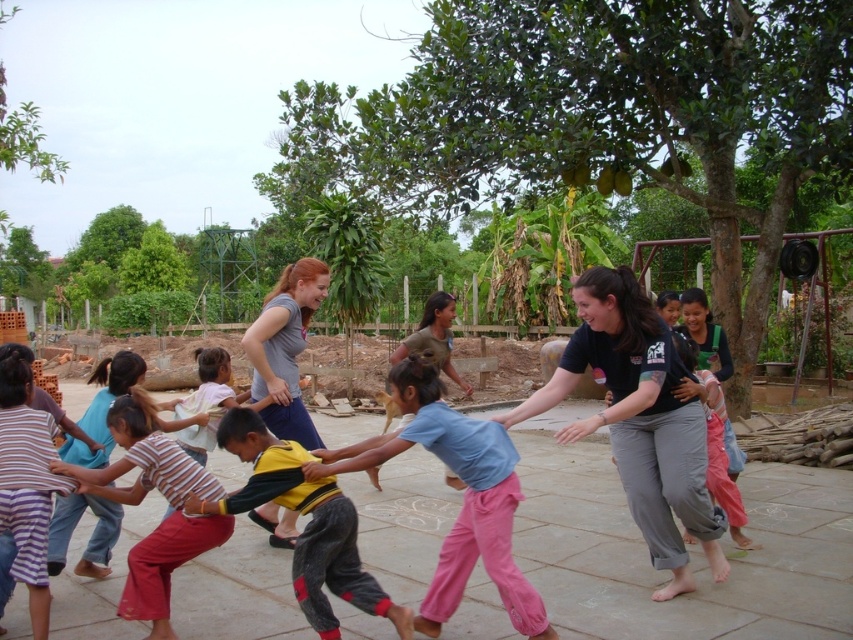
Can you confirm if striped fabric shirt at center is positioned to the left of striped cotton shirt at lower left?

Incorrect, striped fabric shirt at center is not on the left side of striped cotton shirt at lower left.

Looking at this image, can you confirm if striped fabric shirt at center is wider than striped cotton shirt at lower left?

Indeed, striped fabric shirt at center has a greater width compared to striped cotton shirt at lower left.

Find the location of a particular element. striped fabric shirt at center is located at coordinates (141, 499).

In order to click on striped fabric shirt at center in this screenshot , I will do point(141,499).

Between striped fabric shirt at center and smooth beige hand at center, which one appears on the left side from the viewer's perspective?

From the viewer's perspective, smooth beige hand at center appears more on the left side.

Who is more forward, (84, 477) or (206, 422)?

Positioned in front is point (84, 477).

You are a GUI agent. You are given a task and a screenshot of the screen. Output one action in this format:
    pyautogui.click(x=<x>, y=<y>)
    Task: Click on the striped fabric shirt at center
    The width and height of the screenshot is (853, 640).
    Given the screenshot: What is the action you would take?
    pyautogui.click(x=141, y=499)

Which is in front, point (479, 516) or point (596, 420)?

Point (479, 516)

Does light blue cotton shirt at center have a greater height compared to smooth skin hand at center?

Indeed, light blue cotton shirt at center has a greater height compared to smooth skin hand at center.

Is point (502, 525) farther from camera compared to point (567, 424)?

No, it is not.

Locate an element on the screen. light blue cotton shirt at center is located at coordinates (463, 499).